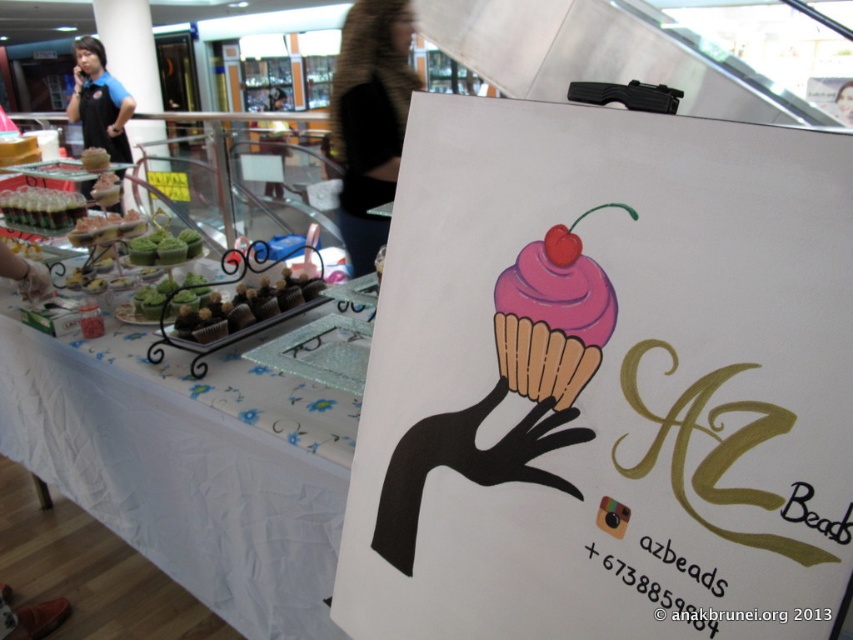
Question: Does white fabric tablecloth at lower left appear on the left side of pink matte cupcake at center?

Choices:
 (A) yes
 (B) no

Answer: (A)

Question: Is white fabric tablecloth at lower left below pink matte cupcake at center?

Choices:
 (A) yes
 (B) no

Answer: (A)

Question: Among these objects, which one is nearest to the camera?

Choices:
 (A) pink matte cupcake at center
 (B) white fabric tablecloth at lower left

Answer: (A)

Question: Which of the following is the farthest from the observer?

Choices:
 (A) white fabric tablecloth at lower left
 (B) pink matte cupcake at center

Answer: (A)

Question: Does white fabric tablecloth at lower left appear on the right side of pink matte cupcake at center?

Choices:
 (A) yes
 (B) no

Answer: (B)